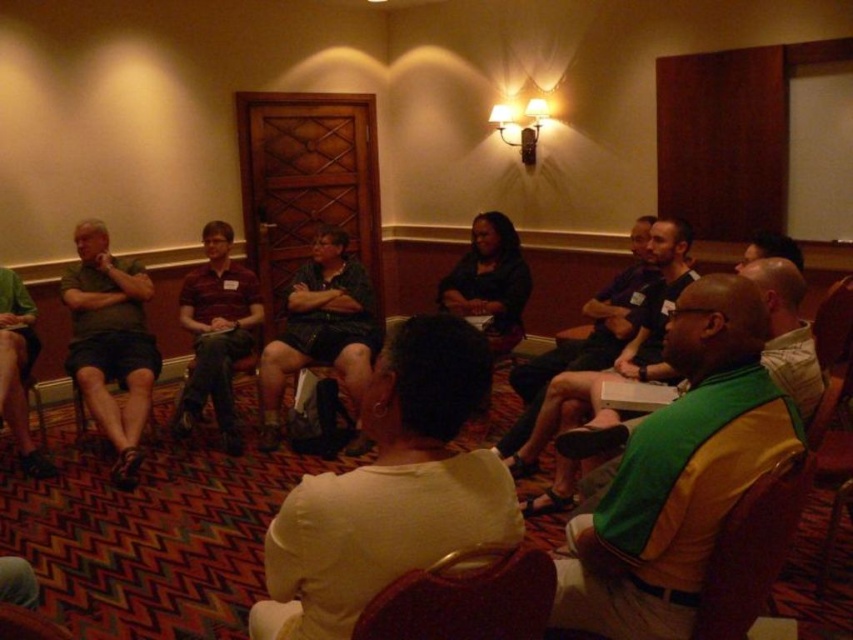
Question: Can you confirm if black fabric chair at lower left is thinner than wooden chair at lower left?

Choices:
 (A) yes
 (B) no

Answer: (B)

Question: Which is farther from the dark green jersey at center?

Choices:
 (A) maroon shirt at center
 (B) matte gray shirt at center

Answer: (B)

Question: Is dark blue sweater at center thinner than black fabric chair at lower left?

Choices:
 (A) yes
 (B) no

Answer: (B)

Question: Is matte gray shirt at center to the left of black fabric chair at lower left from the viewer's perspective?

Choices:
 (A) no
 (B) yes

Answer: (B)

Question: Which object appears farthest from the camera in this image?

Choices:
 (A) wooden chair at lower left
 (B) green/yellow jersey at center

Answer: (B)

Question: Which of the following is the closest to the observer?

Choices:
 (A) green/yellow jersey at center
 (B) green matte shirt at left

Answer: (A)